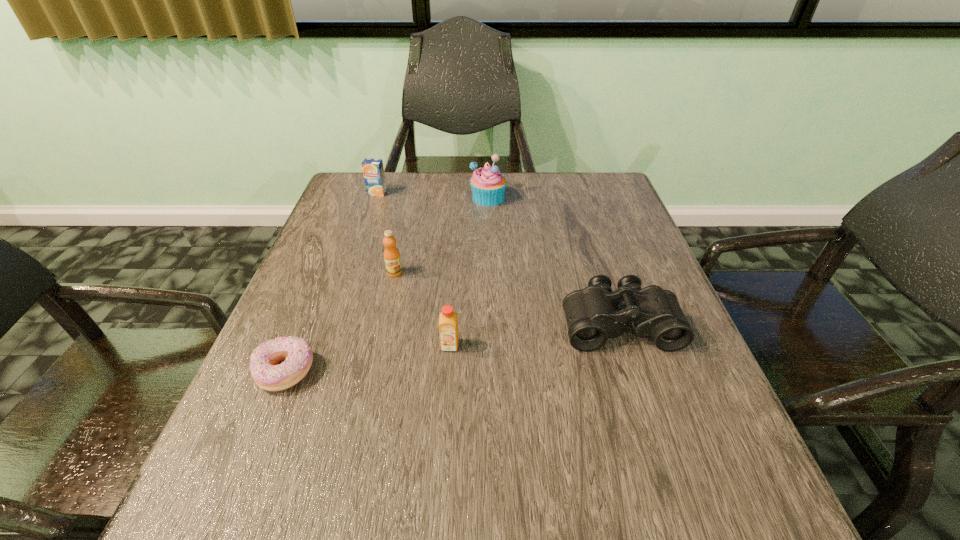
The image size is (960, 540). In order to click on vacant space at the near edge of the desktop in this screenshot , I will do `click(584, 506)`.

Where is `vacant space at the left edge`? This screenshot has width=960, height=540. vacant space at the left edge is located at coordinates (312, 383).

Find the location of `vacant region at the right edge`. vacant region at the right edge is located at coordinates (730, 448).

This screenshot has width=960, height=540. In order to click on vacant space at the far left corner of the desktop in this screenshot , I will do `click(376, 212)`.

Identify the location of free space at the near left corner of the desktop. (180, 525).

In the image, there is a desktop. Where is `vacant space at the far right corner`? vacant space at the far right corner is located at coordinates click(615, 200).

Identify the location of free spot between the fourth object from right to left and the fifth object from left to right. Image resolution: width=960 pixels, height=540 pixels. (442, 235).

Identify the location of vacant space that's between the doughnut and the second farthest orange juice. (341, 322).

At what (x,y) coordinates should I click in order to perform the action: click on vacant space that is in between the muffin and the shortest object. Please return your answer as a coordinate pair (x, y). The height and width of the screenshot is (540, 960). Looking at the image, I should click on (388, 285).

Identify the location of blank region between the second orange juice from right to left and the muffin. (442, 235).